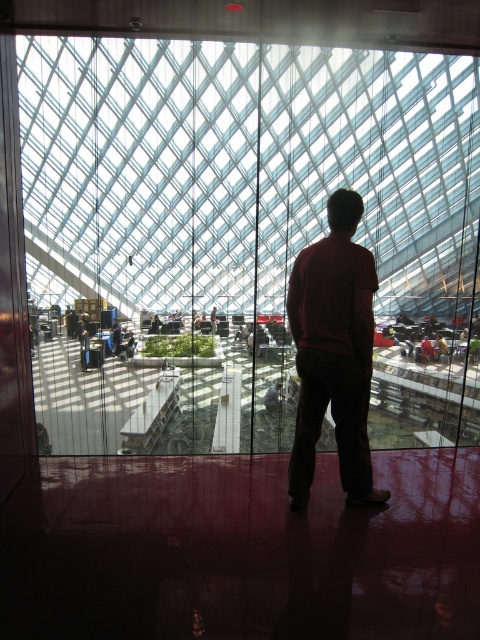
You are standing inside the modern architectural space and want to see the view outside through the transparent glass window at center. However, there is a dark red sweater at center in your way. Which object should you move to get a clear view?

You should move the dark red sweater at center because the transparent glass window at center is positioned over it, so removing the sweater would allow you to see through the window clearly.